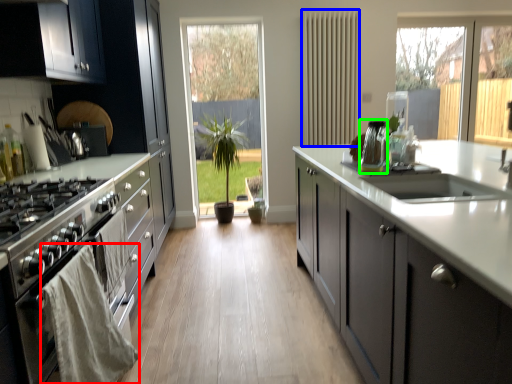
Question: Estimate the real-world distances between objects in this image. Which object is farther from material (highlighted by a red box), radiator (highlighted by a blue box) or appliance (highlighted by a green box)?

Choices:
 (A) radiator
 (B) appliance

Answer: (A)